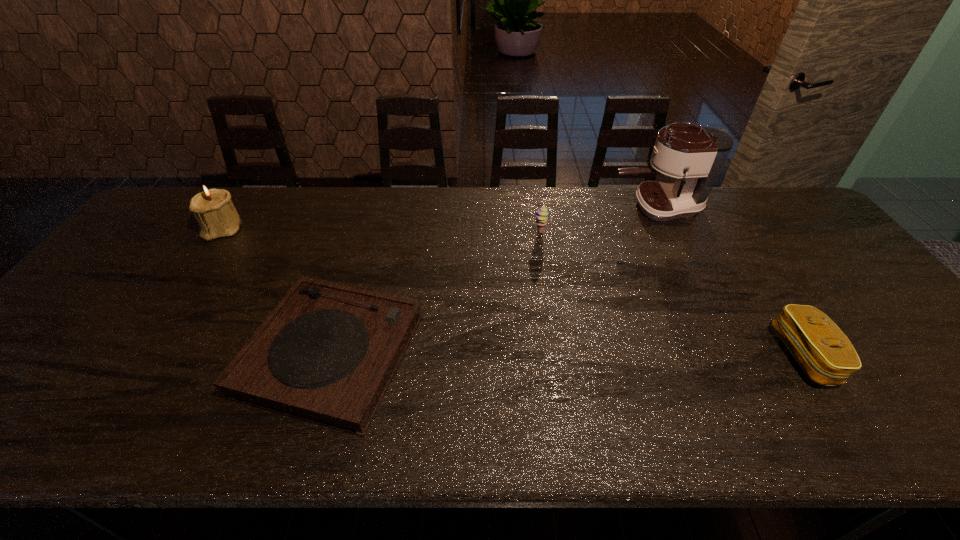
Image resolution: width=960 pixels, height=540 pixels. In the image, there is a desktop. In order to click on free region at the far edge in this screenshot , I will do `click(719, 205)`.

In the image, there is a desktop. Where is `free space at the near edge`? free space at the near edge is located at coordinates (316, 425).

Identify the location of vacant region at the right edge. This screenshot has width=960, height=540. (831, 308).

You are a GUI agent. You are given a task and a screenshot of the screen. Output one action in this format:
    pyautogui.click(x=<x>, y=<y>)
    Task: Click on the vacant area that lies between the candle_holder and the third object from left to right
    Image resolution: width=960 pixels, height=540 pixels.
    Given the screenshot: What is the action you would take?
    pyautogui.click(x=382, y=231)

The image size is (960, 540). Identify the location of free space between the clutch bag and the sherbert. (672, 294).

Where is `vacant region between the clutch bag and the leftmost object`? This screenshot has height=540, width=960. vacant region between the clutch bag and the leftmost object is located at coordinates (515, 292).

Locate an element on the screen. The image size is (960, 540). blank region between the candle_holder and the coffee maker is located at coordinates (441, 218).

Find the location of `free space between the third object from right to left and the clutch bag`. free space between the third object from right to left and the clutch bag is located at coordinates tap(672, 294).

At what (x,y) coordinates should I click in order to perform the action: click on free spot between the candle_holder and the coffee maker. Please return your answer as a coordinate pair (x, y). Image resolution: width=960 pixels, height=540 pixels. Looking at the image, I should click on (441, 218).

Locate an element on the screen. The width and height of the screenshot is (960, 540). vacant space that is in between the fourth shortest object and the clutch bag is located at coordinates (515, 292).